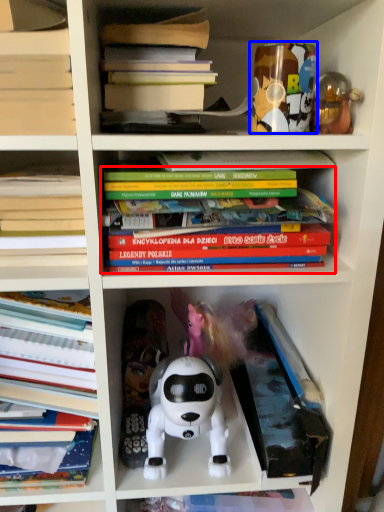
Question: Which point is closer to the camera, book (highlighted by a red box) or toy (highlighted by a blue box)?

Choices:
 (A) book
 (B) toy

Answer: (A)